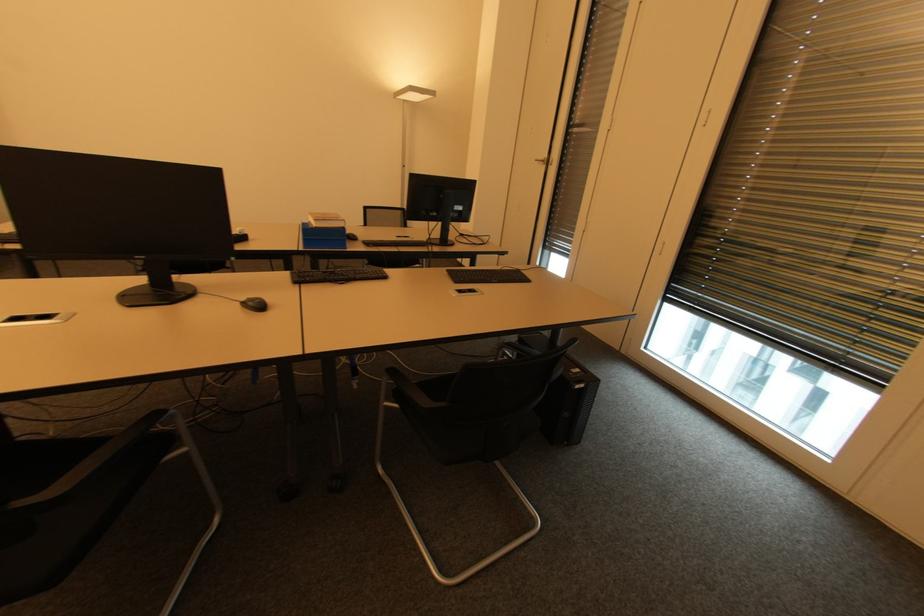
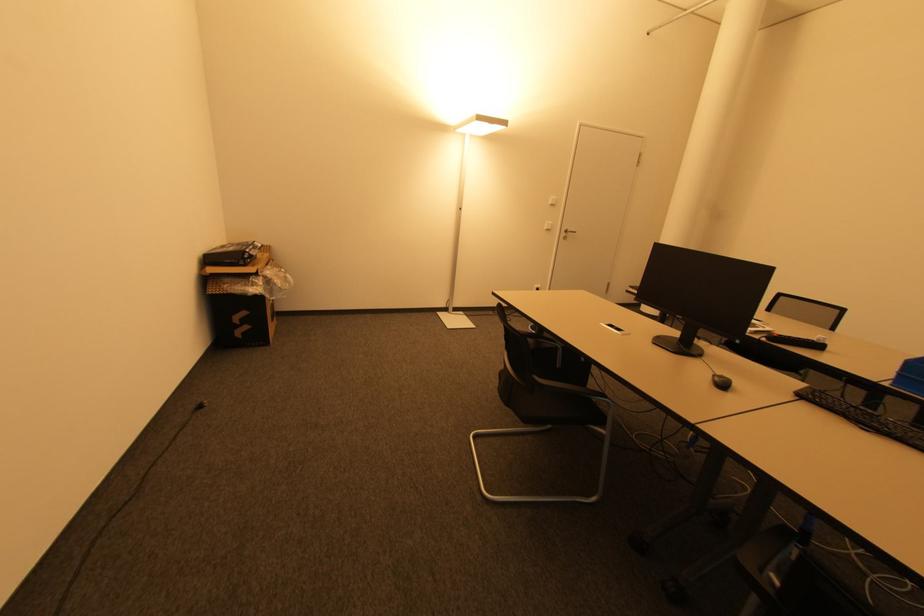
In the second image, find the point that corresponds to point (261, 307) in the first image.

(725, 386)